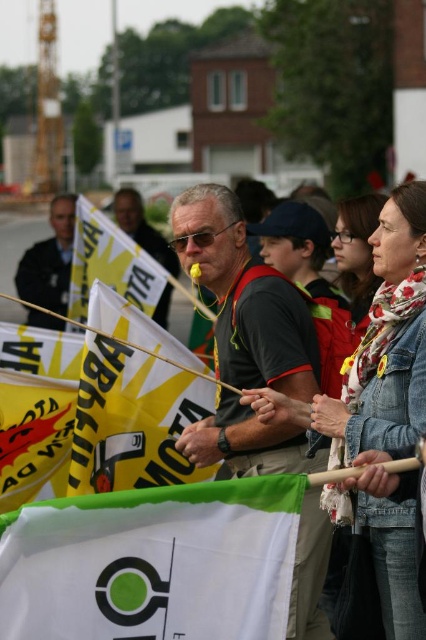
You are a photographer trying to capture both the yellow fabric flag at center and the yellow paper flag at lower left in a single shot. Based on their positions, which flag should you adjust your camera to focus on first to ensure both are in the frame?

The yellow fabric flag at center is to the left of the yellow paper flag at lower left, so you should focus on the yellow paper flag at lower left first to ensure both are captured in the frame.

You are a photographer trying to capture the protest scene. You notice a point at coordinates (x=152, y=563). What object is this point located on?

The point at coordinates (x=152, y=563) is located on the white fabric flag at lower center.

You are a photographer trying to capture a photo of the matte black shirt at center and the white fabric flag at lower center. Which object should you focus on first to ensure both are in focus without adjusting the camera settings?

The white fabric flag at lower center is closer to the viewer than the matte black shirt at center. To keep both in focus, you should focus on the matte black shirt at center first because it is farther away, and the depth of field will naturally include the closer object.